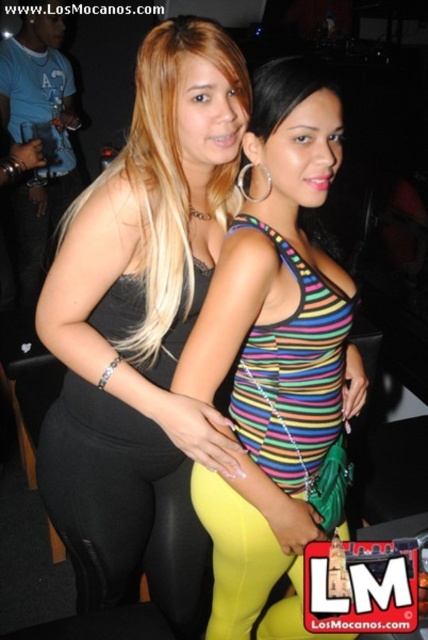
Is point (85, 596) more distant than point (264, 572)?

Yes.

Does black leggings at center lie behind yellow spandex leggings at lower center?

Yes, black leggings at center is behind yellow spandex leggings at lower center.

Who is more distant from viewer, (181,467) or (265,621)?

The point (265,621) is behind.

This screenshot has width=428, height=640. In order to click on black leggings at center in this screenshot , I will do `click(124, 516)`.

Is matte black tank top at center below yellow spandex leggings at lower center?

Actually, matte black tank top at center is above yellow spandex leggings at lower center.

Who is shorter, matte black tank top at center or yellow spandex leggings at lower center?

yellow spandex leggings at lower center

Who is more forward, (255, 564) or (231, 611)?

Point (255, 564) is more forward.

At what (x,y) coordinates should I click in order to perform the action: click on matte black tank top at center. Please return your answer as a coordinate pair (x, y). Image resolution: width=428 pixels, height=640 pixels. Looking at the image, I should click on (282, 269).

How much distance is there between black matte tank top at center and yellow spandex leggings at lower center?

black matte tank top at center and yellow spandex leggings at lower center are 28.35 centimeters apart from each other.

Can you confirm if black matte tank top at center is smaller than yellow spandex leggings at lower center?

Actually, black matte tank top at center might be larger than yellow spandex leggings at lower center.

In the scene shown: Who is more distant from viewer, (175,132) or (231,586)?

Point (231,586)

The image size is (428, 640). Identify the location of black matte tank top at center. (142, 328).